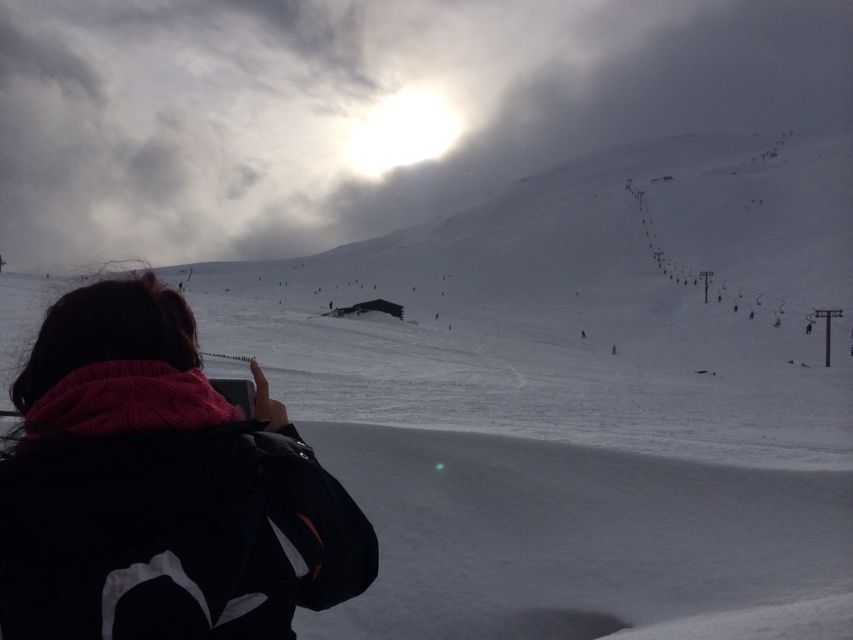
Question: Is cloudy white snow at upper center bigger than black fleece jacket at lower left?

Choices:
 (A) no
 (B) yes

Answer: (B)

Question: Is cloudy white snow at upper center smaller than black fleece jacket at lower left?

Choices:
 (A) no
 (B) yes

Answer: (A)

Question: Which point appears farthest from the camera in this image?

Choices:
 (A) (177, 204)
 (B) (25, 541)

Answer: (A)

Question: Is cloudy white snow at upper center to the right of black fleece jacket at lower left from the viewer's perspective?

Choices:
 (A) no
 (B) yes

Answer: (B)

Question: Which point is closer to the camera?

Choices:
 (A) cloudy white snow at upper center
 (B) black fleece jacket at lower left

Answer: (B)